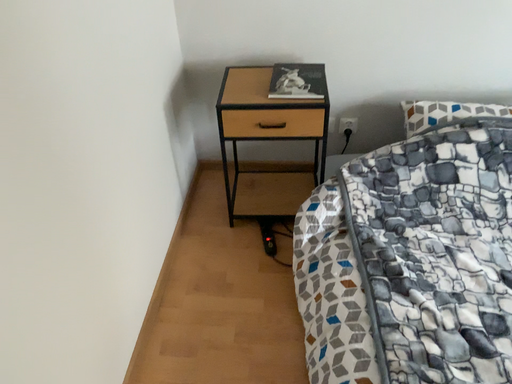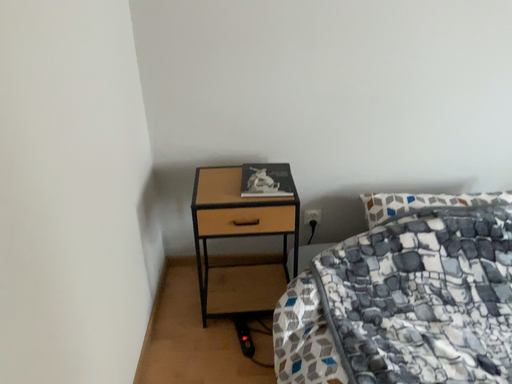
Question: Which way did the camera rotate in the video?

Choices:
 (A) rotated downward
 (B) rotated upward

Answer: (B)